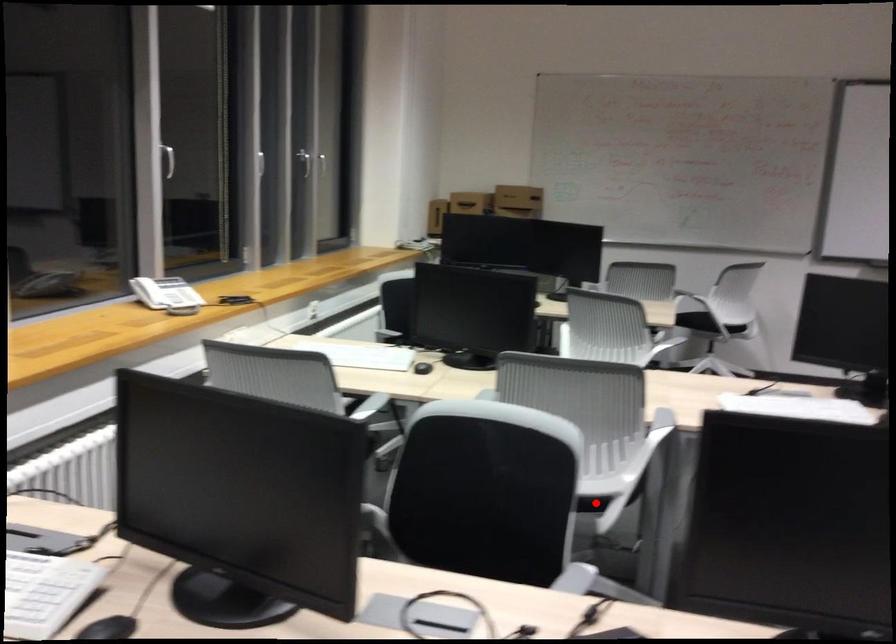
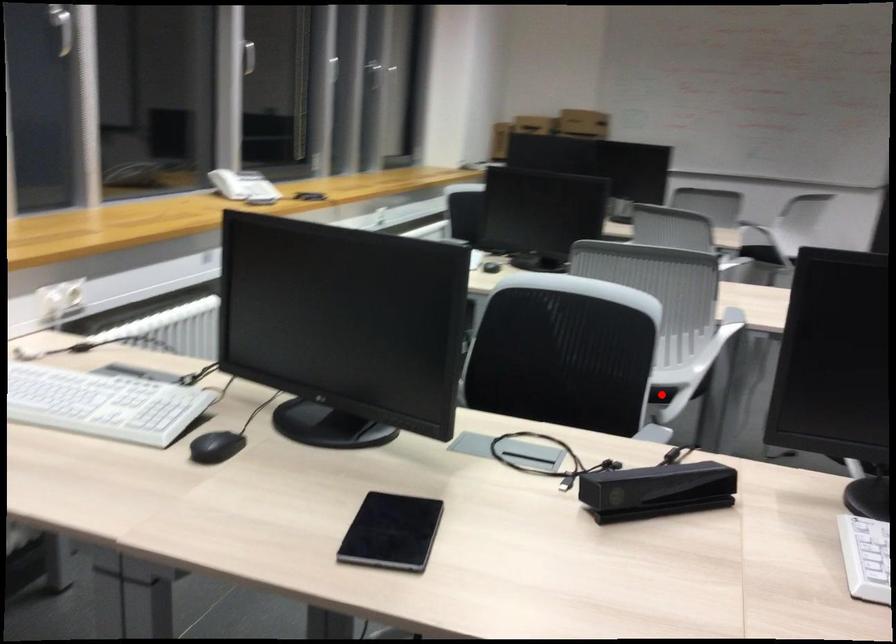
I am providing you with two images of the same scene from different viewpoints. A red point is marked on the first image and another point is marked on the second image. Do the highlighted points in image1 and image2 indicate the same real-world spot?

Yes